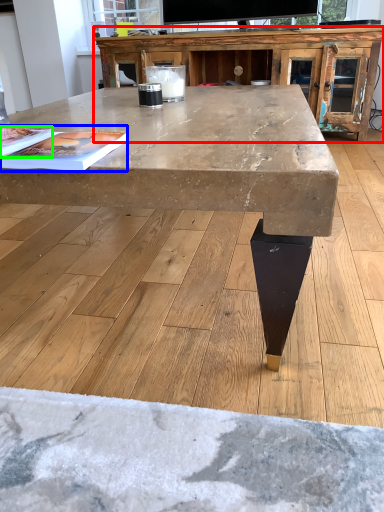
Question: Based on their relative distances, which object is nearer to entertainment center (highlighted by a red box)? Choose from magazine (highlighted by a blue box) and magazine (highlighted by a green box).

Choices:
 (A) magazine
 (B) magazine

Answer: (A)